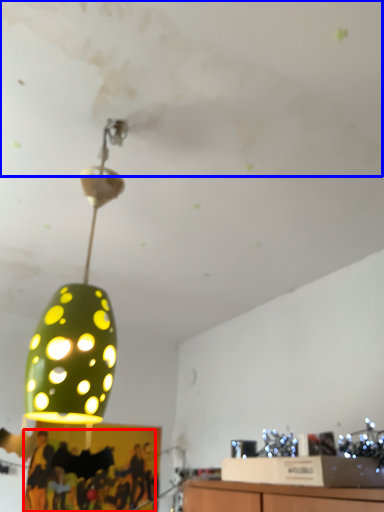
Question: Which of the following is the farthest to the observer, person (highlighted by a red box) or cloud (highlighted by a blue box)?

Choices:
 (A) person
 (B) cloud

Answer: (A)